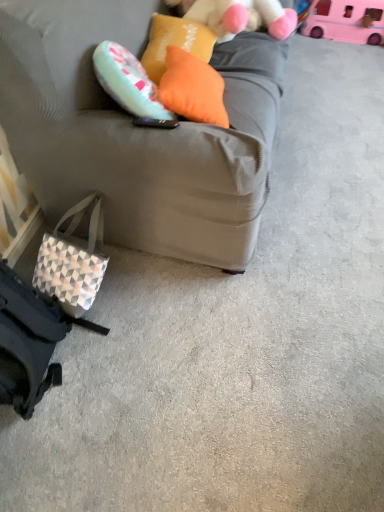
Question: Based on their positions, is orange fabric pillow at upper center, which is the 2th pillow from front to back, located to the left or right of fluffy white teddy bear at upper center?

Choices:
 (A) right
 (B) left

Answer: (B)

Question: From the image's perspective, is orange fabric pillow at upper center, which is the 2th pillow from front to back, located above or below fluffy white teddy bear at upper center?

Choices:
 (A) below
 (B) above

Answer: (A)

Question: Estimate the real-world distances between objects in this image. Which object is farther from the geometric-patterned fabric pouch at lower left?

Choices:
 (A) orange fabric pillow at upper center, which is the 2th pillow from front to back
 (B) orange fabric pillow at upper center, placed as the second pillow when sorted from back to front
 (C) fluffy white teddy bear at upper center
 (D) pink plastic toy at upper right
 (E) matte gray couch at center

Answer: (D)

Question: Estimate the real-world distances between objects in this image. Which object is farther from the geometric-patterned fabric pouch at lower left?

Choices:
 (A) fluffy white teddy bear at upper center
 (B) pink plastic toy at upper right
 (C) orange fabric pillow at upper center, placed as the second pillow when sorted from back to front
 (D) orange fabric pillow at upper center, which is the 2th pillow from front to back
 (E) matte gray couch at center

Answer: (B)